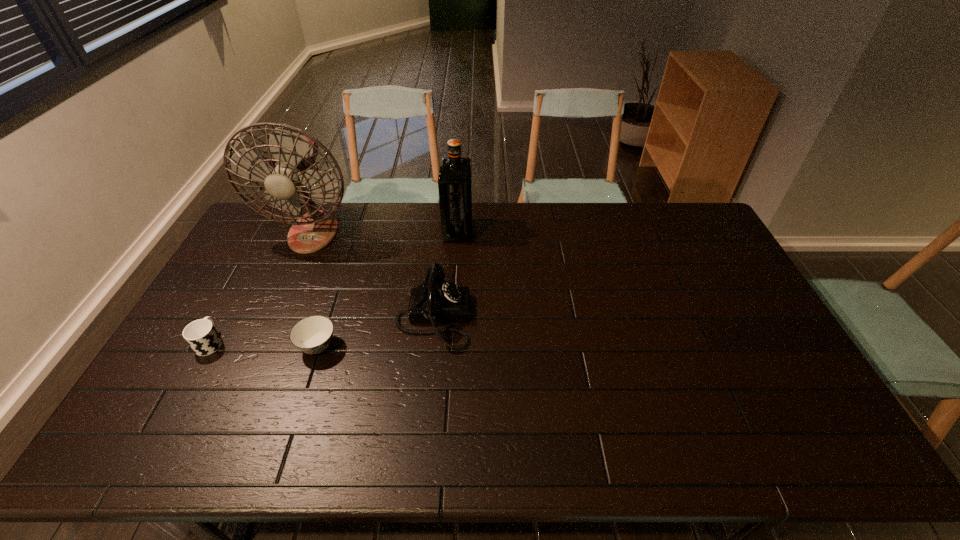
Where is `free area in between the cup and the fan`? This screenshot has width=960, height=540. free area in between the cup and the fan is located at coordinates (262, 287).

This screenshot has height=540, width=960. I want to click on object identified as the fourth closest to the fan, so click(x=312, y=335).

You are a GUI agent. You are given a task and a screenshot of the screen. Output one action in this format:
    pyautogui.click(x=<x>, y=<y>)
    Task: Click on the object that stands as the closest to the third shortest object
    
    Given the screenshot: What is the action you would take?
    pyautogui.click(x=312, y=335)